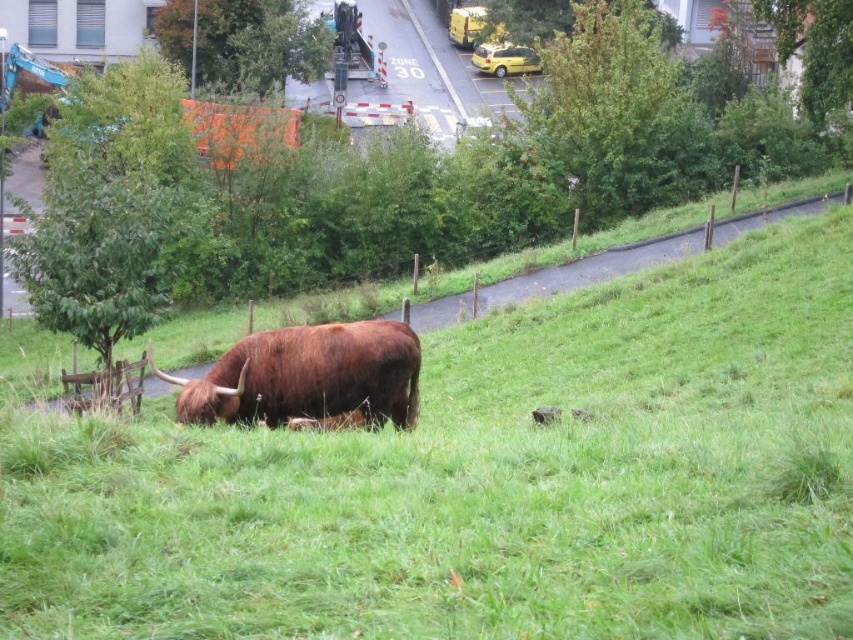
Question: Is green grassy at center to the right of brown furry bull at center from the viewer's perspective?

Choices:
 (A) no
 (B) yes

Answer: (B)

Question: Among these points, which one is farthest from the camera?

Choices:
 (A) (366, 349)
 (B) (207, 586)

Answer: (A)

Question: Can you confirm if green grassy at center is positioned to the right of brown furry bull at center?

Choices:
 (A) yes
 (B) no

Answer: (A)

Question: Does green grassy at center come in front of brown furry bull at center?

Choices:
 (A) yes
 (B) no

Answer: (A)

Question: Which point is closer to the camera?

Choices:
 (A) brown furry bull at center
 (B) green grassy at center

Answer: (B)